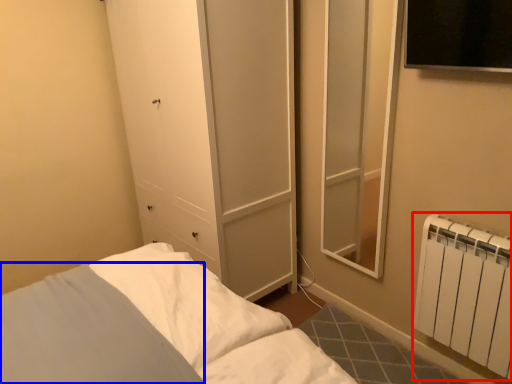
Question: Which object is further to the camera taking this photo, radiator (highlighted by a red box) or pillow (highlighted by a blue box)?

Choices:
 (A) radiator
 (B) pillow

Answer: (A)